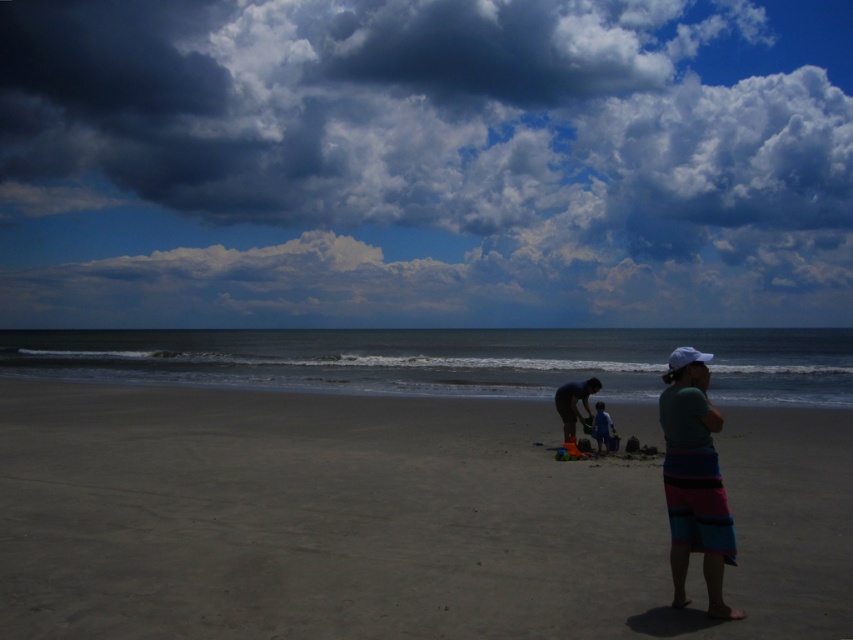
Consider the image. You are standing at the point marked by the coordinates point (x=573, y=403). Looking towards the ocean, which direction should you walk to reach the nearest beach toy?

The nearest beach toy is located to the right of the point (x=573, y=403). Therefore, you should walk towards the right to reach it.

You are standing on the beach looking towards the ocean. You see a dark gray cloud at upper center and blue fabric pants at center. Which object is positioned to the left when viewed from your perspective?

The dark gray cloud at upper center is positioned to the left of the blue fabric pants at center.

You are standing on the beach and looking at the sky. There is a point marked at coordinates point (424, 163). What is located at that point?

The point (424, 163) is located on a dark gray cloud at upper center.